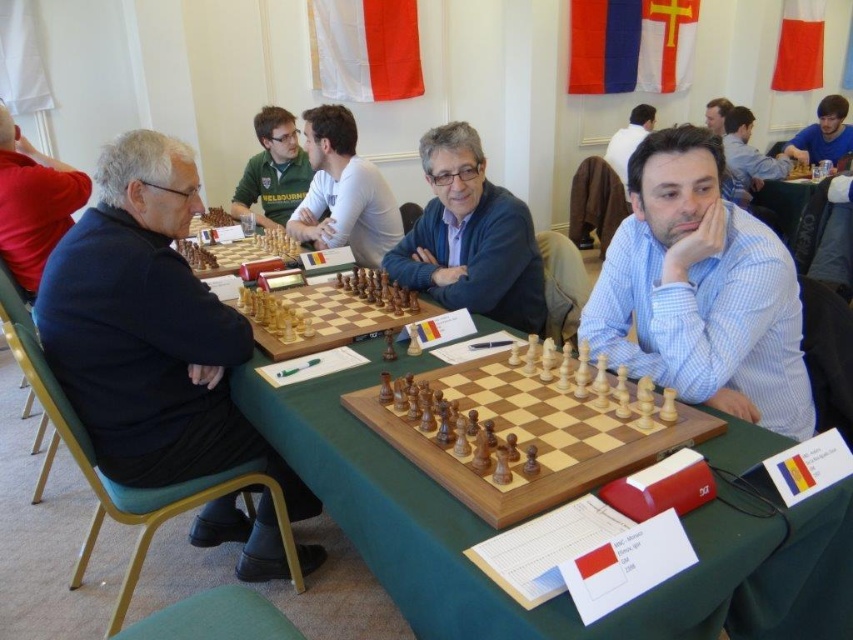
Does matte black jacket at left appear on the right side of matte black shirt at upper center?

No, matte black jacket at left is not to the right of matte black shirt at upper center.

Between matte black jacket at left and matte black shirt at upper center, which one has more height?

With more height is matte black shirt at upper center.

Measure the distance between point (x=55, y=195) and camera.

Point (x=55, y=195) and camera are 9.28 feet apart.

Identify the location of matte black jacket at left. (33, 204).

Can you confirm if green fabric table at center is positioned below black fabric jacket at left?

Yes, green fabric table at center is below black fabric jacket at left.

Who is more forward, (717, 557) or (184, 444)?

Answer: Point (717, 557) is more forward.

Is point (405, 531) farther from camera compared to point (190, 470)?

No, (405, 531) is in front of (190, 470).

Image resolution: width=853 pixels, height=640 pixels. What are the coordinates of `green fabric table at center` in the screenshot? It's located at [x=492, y=532].

Which is in front, point (724, 532) or point (831, 109)?

Point (724, 532) is more forward.

Measure the distance between green fabric table at center and camera.

A distance of 35.07 inches exists between green fabric table at center and camera.

Who is more forward, (740, 566) or (842, 145)?

Positioned in front is point (740, 566).

At what (x,y) coordinates should I click in order to perform the action: click on green fabric table at center. Please return your answer as a coordinate pair (x, y). This screenshot has height=640, width=853. Looking at the image, I should click on (492, 532).